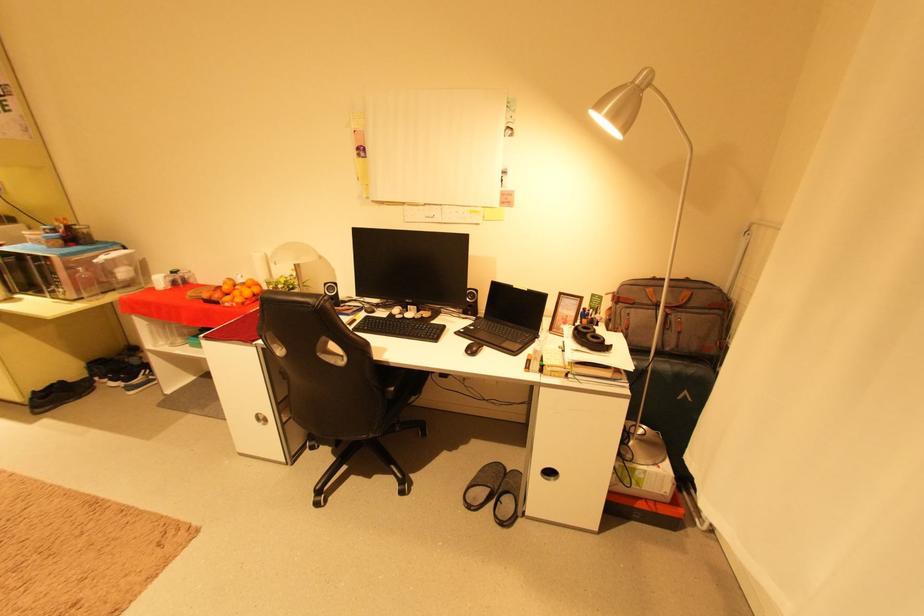
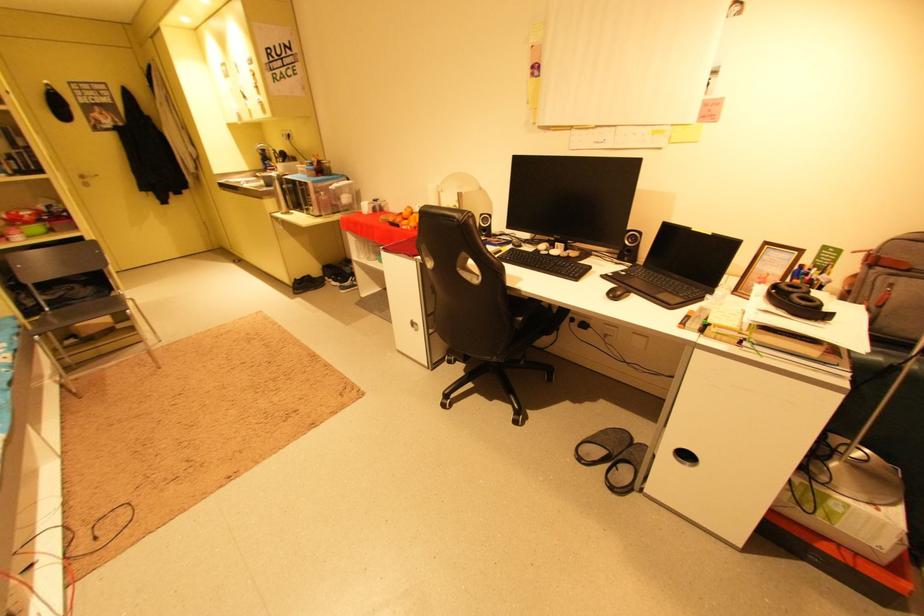
Find the pixel in the second image that matches point 119,275 in the first image.

(346, 200)